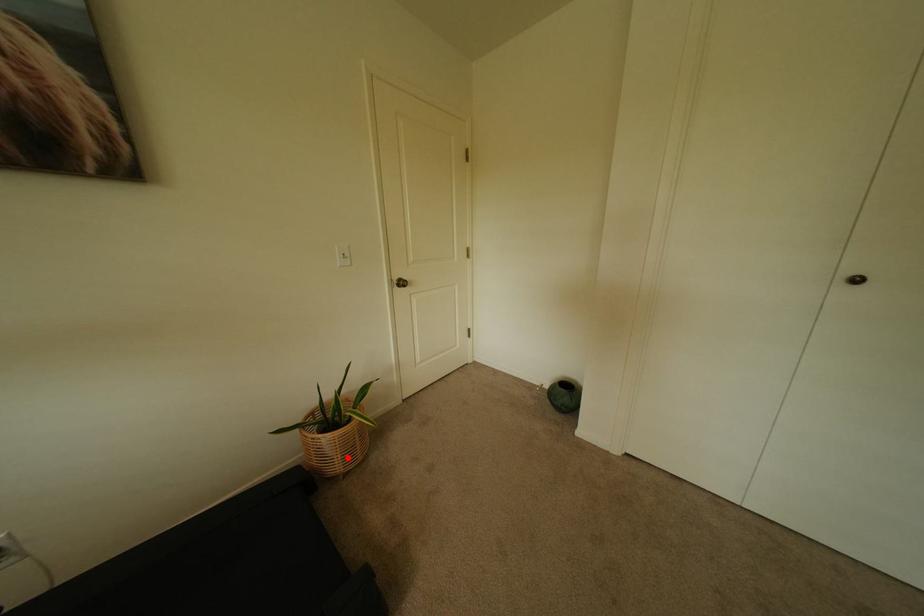
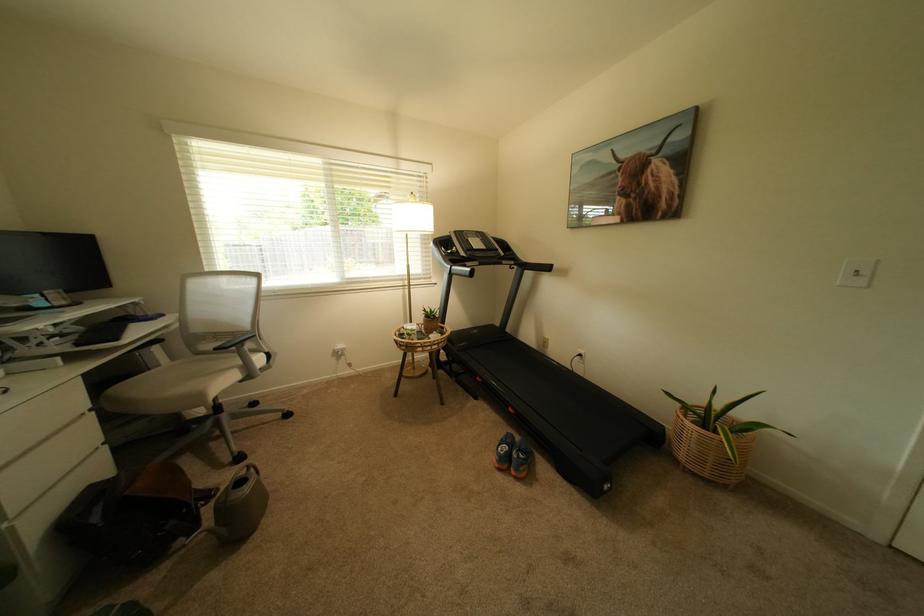
The point at the highlighted location is marked in the first image. Where is the corresponding point in the second image?

(695, 448)